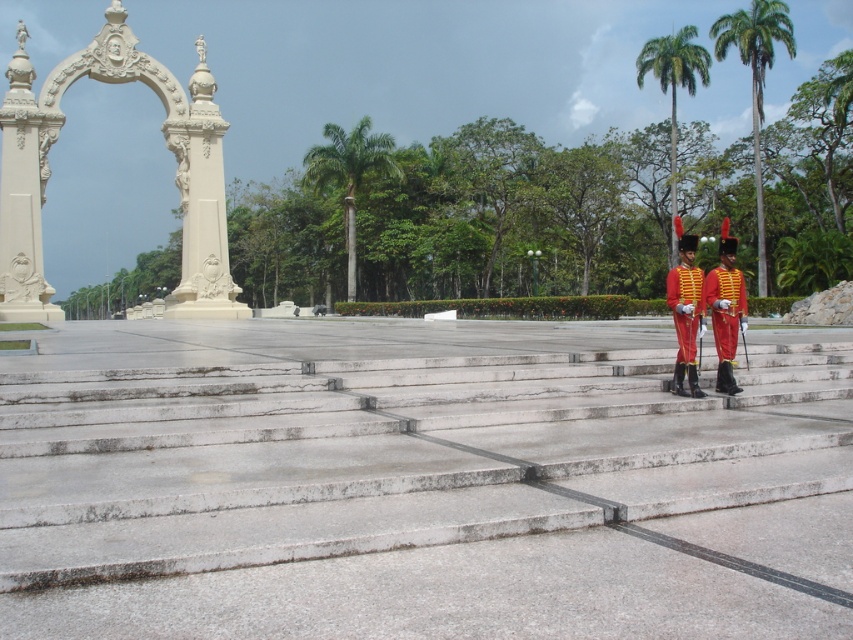
You are standing at the base of the steps in the public square. You want to walk directly towards the green leafy palm tree at center. Which direction should you head?

The green leafy palm tree at center is located at point coordinates of 0.272 on the x axis and 0.410 on the y axis. Since you are at the base of the steps, which are in the foreground, you should walk towards the center of the image to reach the palm tree.

You are standing at the bottom of the smooth concrete stairs at center and want to take a photo of the green leafy palm tree at upper right. Which direction should you tilt your camera to capture the entire tree in the frame without moving from your current position?

You should tilt your camera upwards because the green leafy palm tree at upper right is taller than the smooth concrete stairs at center, so tilting upwards will allow you to capture its full height in the frame while remaining at the bottom of the stairs.